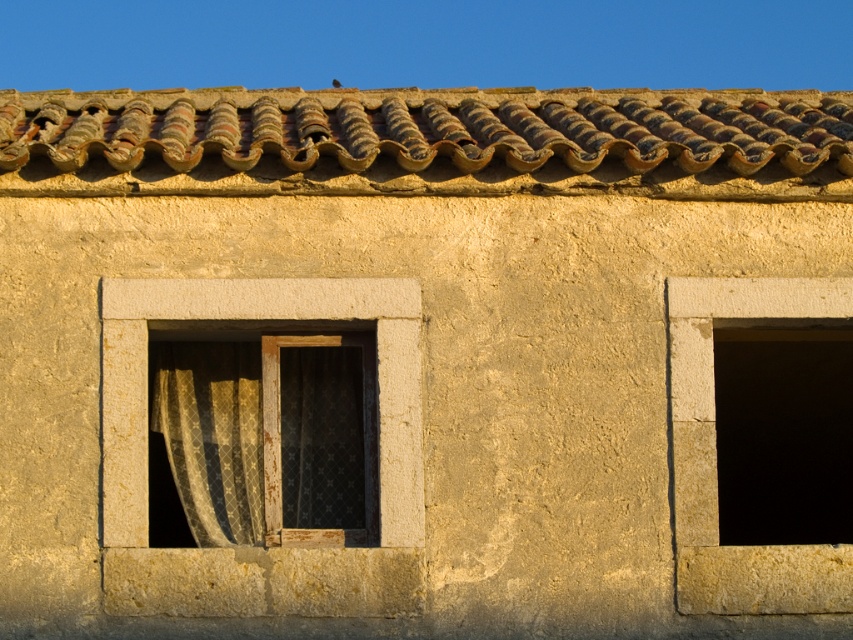
Does rusty clay tiles at top appear on the right side of smooth stone window at right?

Incorrect, rusty clay tiles at top is not on the right side of smooth stone window at right.

Is rusty clay tiles at top bigger than smooth stone window at right?

Yes.

This screenshot has height=640, width=853. What do you see at coordinates (427, 141) in the screenshot?
I see `rusty clay tiles at top` at bounding box center [427, 141].

The height and width of the screenshot is (640, 853). I want to click on rusty clay tiles at top, so click(427, 141).

Which is above, patterned fabric curtain at center-left or smooth stone window at right?

Positioned higher is patterned fabric curtain at center-left.

Image resolution: width=853 pixels, height=640 pixels. Describe the element at coordinates (212, 435) in the screenshot. I see `patterned fabric curtain at center-left` at that location.

Is point (289, 380) positioned behind point (846, 317)?

Yes, point (289, 380) is farther from viewer.

Image resolution: width=853 pixels, height=640 pixels. What are the coordinates of `patterned fabric curtain at center-left` in the screenshot? It's located at (212, 435).

Based on the photo, between rusty clay tiles at top and patterned fabric curtain at center-left, which one appears on the left side from the viewer's perspective?

patterned fabric curtain at center-left is more to the left.

Between rusty clay tiles at top and patterned fabric curtain at center-left, which one is positioned lower?

Positioned lower is patterned fabric curtain at center-left.

Identify the location of rusty clay tiles at top. [x=427, y=141].